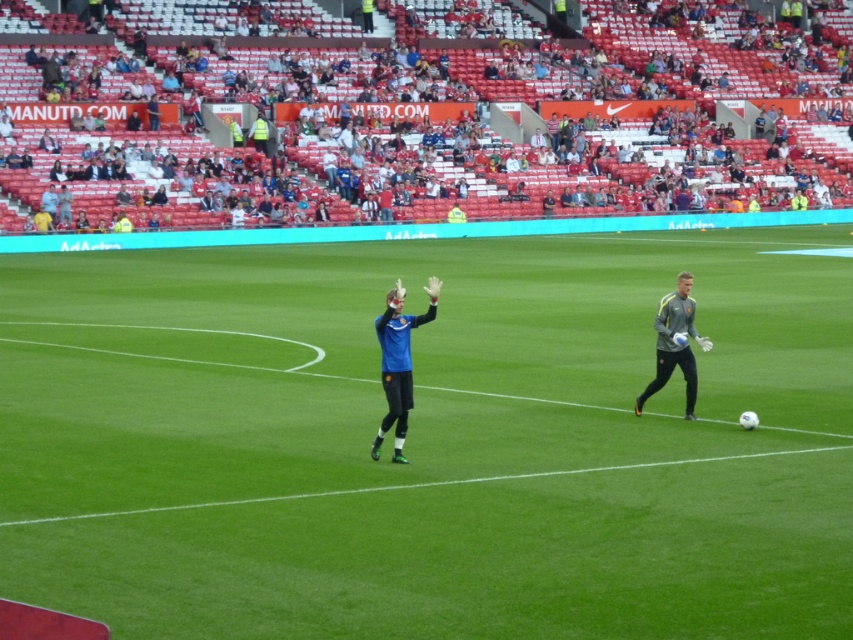
Question: Is green grass field at center positioned at the back of blue matte jersey at center?

Choices:
 (A) yes
 (B) no

Answer: (B)

Question: Is blue jersey at center bigger than gray synthetic jacket at right?

Choices:
 (A) no
 (B) yes

Answer: (B)

Question: Which is farther from the gray synthetic jacket at right?

Choices:
 (A) green grass field at center
 (B) blue matte jersey at center
 (C) blue jersey at center

Answer: (C)

Question: Among these objects, which one is farthest from the camera?

Choices:
 (A) gray synthetic jacket at right
 (B) blue matte jersey at center
 (C) green grass field at center
 (D) blue jersey at center

Answer: (D)

Question: Estimate the real-world distances between objects in this image. Which object is closer to the gray synthetic jacket at right?

Choices:
 (A) blue jersey at center
 (B) blue matte jersey at center

Answer: (B)

Question: Is blue jersey at center positioned in front of blue matte jersey at center?

Choices:
 (A) no
 (B) yes

Answer: (A)